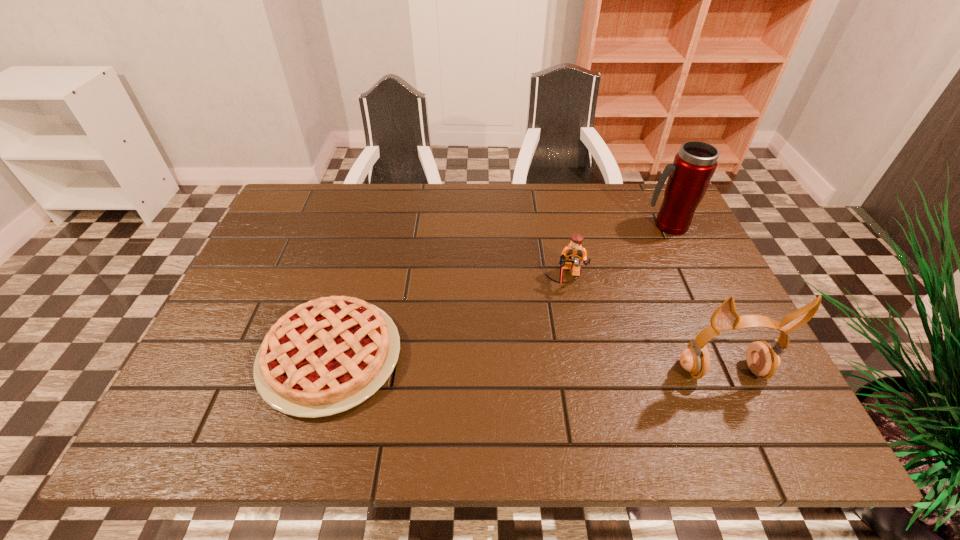
You are a GUI agent. You are given a task and a screenshot of the screen. Output one action in this format:
    pyautogui.click(x=<x>, y=<y>)
    Task: Click on the free space on the desktop that is between the pie and the earphone and is positioned holding a crossbow in the hands of the Lego
    Image resolution: width=960 pixels, height=540 pixels.
    Given the screenshot: What is the action you would take?
    pyautogui.click(x=566, y=364)

Find the location of `free space on the desktop that is between the pie and the earphone and is positioned on the side with the handle of the farthest object`. free space on the desktop that is between the pie and the earphone and is positioned on the side with the handle of the farthest object is located at coordinates (505, 362).